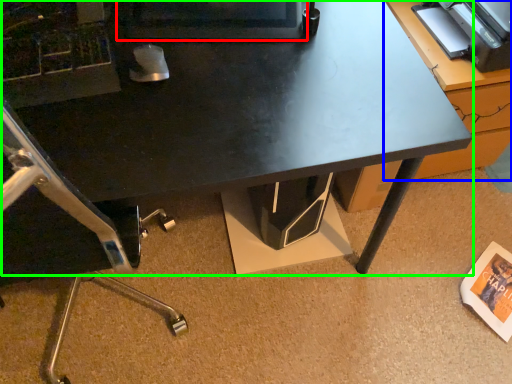
Question: Which is farther away from computer monitor (highlighted by a red box)? table (highlighted by a blue box) or desk (highlighted by a green box)?

Choices:
 (A) table
 (B) desk

Answer: (A)